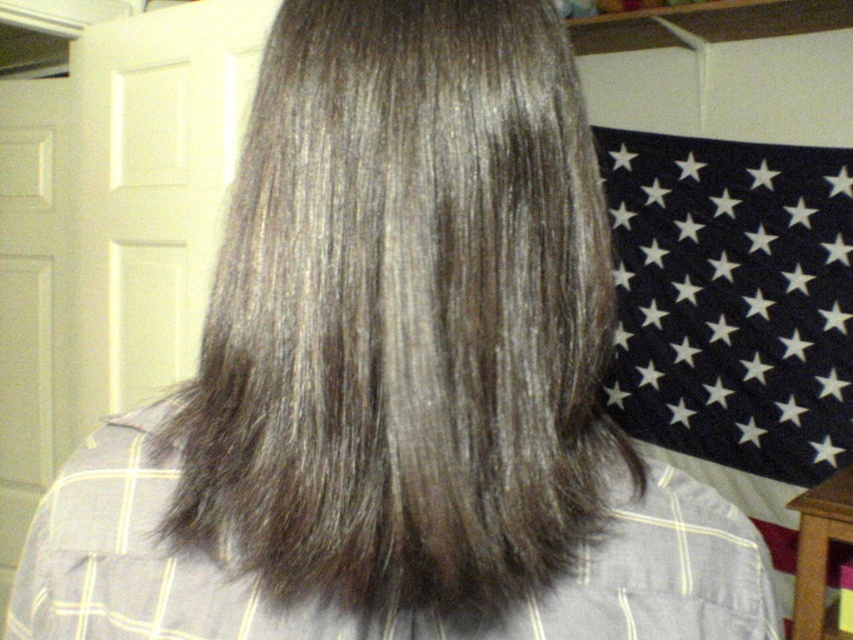
Question: Is black fabric flag at upper right positioned behind gray matte hair at center?

Choices:
 (A) no
 (B) yes

Answer: (B)

Question: Which object is closer to the camera taking this photo?

Choices:
 (A) gray matte hair at center
 (B) dark brown silky hair at center
 (C) black fabric flag at upper right

Answer: (B)

Question: Is the position of dark brown silky hair at center more distant than that of gray matte hair at center?

Choices:
 (A) yes
 (B) no

Answer: (B)

Question: Considering the real-world distances, which object is closest to the black fabric flag at upper right?

Choices:
 (A) gray matte hair at center
 (B) dark brown silky hair at center

Answer: (A)

Question: In this image, where is black fabric flag at upper right located relative to gray matte hair at center?

Choices:
 (A) above
 (B) below

Answer: (A)

Question: Estimate the real-world distances between objects in this image. Which object is farther from the dark brown silky hair at center?

Choices:
 (A) gray matte hair at center
 (B) black fabric flag at upper right

Answer: (B)